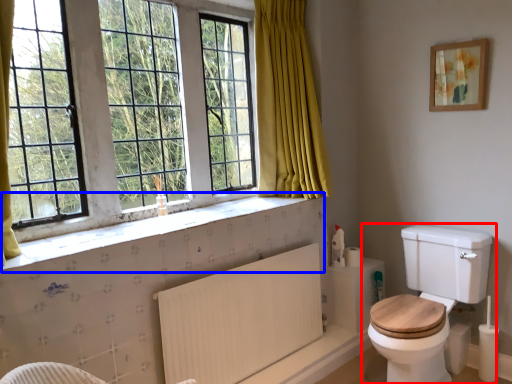
Question: Which of the following is the closest to the observer, toilet (highlighted by a red box) or window sill (highlighted by a blue box)?

Choices:
 (A) toilet
 (B) window sill

Answer: (B)